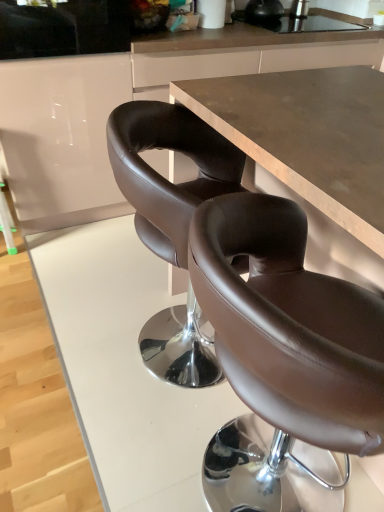
Where is `brown leather chair at center`? The image size is (384, 512). brown leather chair at center is located at coordinates click(x=284, y=360).

What is the approximate height of white glossy cabinet at upper left?

It is 3.48 feet.

Locate an element on the screen. white glossy cabinet at upper left is located at coordinates (61, 138).

Where is `brown matte counter at center`? This screenshot has height=512, width=384. brown matte counter at center is located at coordinates (127, 101).

Where is `brown leather bar stool at left`? This screenshot has width=384, height=512. brown leather bar stool at left is located at coordinates (6, 215).

From a real-world perspective, which object stands above the other?

From a 3D spatial view, white glossy cabinet at upper left is above.

Is white glossy cabinet at upper left positioned with its back to brown leather bar stool at left?

No.

Considering the relative sizes of white glossy cabinet at upper left and brown leather bar stool at left in the image provided, is white glossy cabinet at upper left bigger than brown leather bar stool at left?

Yes.

From the image's perspective, between white glossy cabinet at upper left and brown leather bar stool at left, which one is located above?

white glossy cabinet at upper left appears higher in the image.

Between brown matte counter at center and brown leather chair at center, which one is positioned in front?

brown leather chair at center is closer to the camera.

Considering the sizes of objects brown matte counter at center and brown leather chair at center in the image provided, who is smaller, brown matte counter at center or brown leather chair at center?

Smaller between the two is brown leather chair at center.

Is brown matte counter at center outside of brown leather chair at center?

brown matte counter at center is positioned outside brown leather chair at center.

From a real-world perspective, is brown matte counter at center above or below brown leather chair at center?

brown matte counter at center is situated higher than brown leather chair at center in the real world.

Which object is positioned more to the right, brown leather bar stool at left or brown leather chair at center?

From the viewer's perspective, brown leather chair at center appears more on the right side.

Considering the relative sizes of brown leather bar stool at left and brown leather chair at center in the image provided, is brown leather bar stool at left bigger than brown leather chair at center?

Actually, brown leather bar stool at left might be smaller than brown leather chair at center.

Is the position of brown leather bar stool at left less distant than that of brown leather chair at center?

No, brown leather bar stool at left is behind brown leather chair at center.

Is brown leather bar stool at left to the left or to the right of white glossy cabinet at upper left in the image?

brown leather bar stool at left is to the left of white glossy cabinet at upper left.

From a real-world perspective, is brown leather bar stool at left over white glossy cabinet at upper left?

Actually, brown leather bar stool at left is physically below white glossy cabinet at upper left in the real world.

From the picture: Can you see brown leather bar stool at left touching white glossy cabinet at upper left?

There is a gap between brown leather bar stool at left and white glossy cabinet at upper left.

Can you confirm if brown leather bar stool at left is bigger than white glossy cabinet at upper left?

Incorrect, brown leather bar stool at left is not larger than white glossy cabinet at upper left.

Which object is positioned more to the left, brown leather chair at center or brown leather bar stool at left?

From the viewer's perspective, brown leather bar stool at left appears more on the left side.

From a real-world perspective, who is located lower, brown leather chair at center or brown leather bar stool at left?

In real-world perspective, brown leather bar stool at left is lower.

Is brown leather chair at center in contact with brown leather bar stool at left?

No, brown leather chair at center is not touching brown leather bar stool at left.

Is brown leather chair at center oriented towards brown leather bar stool at left?

No, brown leather chair at center is not aimed at brown leather bar stool at left.

Is brown leather chair at center not near white glossy cabinet at upper left?

That's right, there is a large distance between brown leather chair at center and white glossy cabinet at upper left.

How far apart are brown leather chair at center and white glossy cabinet at upper left?

A distance of 1.35 meters exists between brown leather chair at center and white glossy cabinet at upper left.

Does brown leather chair at center have a smaller size compared to white glossy cabinet at upper left?

Yes.

Does brown leather chair at center appear on the right side of white glossy cabinet at upper left?

Indeed, brown leather chair at center is positioned on the right side of white glossy cabinet at upper left.

From a real-world perspective, between white glossy cabinet at upper left and brown leather chair at center, who is vertically lower?

brown leather chair at center.

Considering the sizes of white glossy cabinet at upper left and brown leather chair at center in the image, is white glossy cabinet at upper left bigger or smaller than brown leather chair at center?

Clearly, white glossy cabinet at upper left is larger in size than brown leather chair at center.

Between point (76, 148) and point (328, 471), which one is positioned behind?

The point (76, 148) is more distant.

At what (x,y) coordinates should I click in order to perform the action: click on bar stool that is under the white glossy cabinet at upper left (from a real-world perspective). Please return your answer as a coordinate pair (x, y). Image resolution: width=384 pixels, height=512 pixels. Looking at the image, I should click on (6, 215).

The image size is (384, 512). What are the coordinates of `counter behind the brown leather chair at center` in the screenshot? It's located at (127, 101).

When comparing their distances from white glossy cabinet at upper left, does brown leather bar stool at left or brown leather chair at center seem closer?

brown leather bar stool at left lies closer to white glossy cabinet at upper left than the other object.

Which object lies further to the anchor point brown leather chair at center, brown leather bar stool at left or brown matte counter at center?

brown leather bar stool at left is positioned further to the anchor brown leather chair at center.

In the scene shown: Which object lies nearer to the anchor point brown leather chair at center, brown matte counter at center or brown leather bar stool at left?

brown matte counter at center.

From the image, which object appears to be farther from white glossy cabinet at upper left, brown leather chair at center or brown matte counter at center?

brown leather chair at center.

Looking at the image, which one is located closer to brown leather chair at center, brown matte counter at center or white glossy cabinet at upper left?

Based on the image, white glossy cabinet at upper left appears to be nearer to brown leather chair at center.

Consider the image. Which object lies further to the anchor point brown matte counter at center, brown leather chair at center or brown leather bar stool at left?

The object further to brown matte counter at center is brown leather chair at center.

Based on their spatial positions, is white glossy cabinet at upper left or brown leather chair at center closer to brown matte counter at center?

white glossy cabinet at upper left is positioned closer to the anchor brown matte counter at center.

Looking at the image, which one is located closer to white glossy cabinet at upper left, brown leather chair at center or brown leather bar stool at left?

brown leather bar stool at left is positioned closer to the anchor white glossy cabinet at upper left.

At what (x,y) coordinates should I click in order to perform the action: click on cabinetry between brown leather chair at center and brown matte counter at center along the z-axis. Please return your answer as a coordinate pair (x, y). This screenshot has height=512, width=384. Looking at the image, I should click on (61, 138).

You are a GUI agent. You are given a task and a screenshot of the screen. Output one action in this format:
    pyautogui.click(x=<x>, y=<y>)
    Task: Click on the bar stool between brown leather chair at center and brown matte counter at center in the front-back direction
    
    Given the screenshot: What is the action you would take?
    pyautogui.click(x=6, y=215)

Locate an element on the screen. The image size is (384, 512). cabinetry between brown leather bar stool at left and brown matte counter at center in the horizontal direction is located at coordinates (61, 138).

Find the location of a particular element. The height and width of the screenshot is (512, 384). cabinetry positioned between brown leather chair at center and brown leather bar stool at left from near to far is located at coordinates (61, 138).